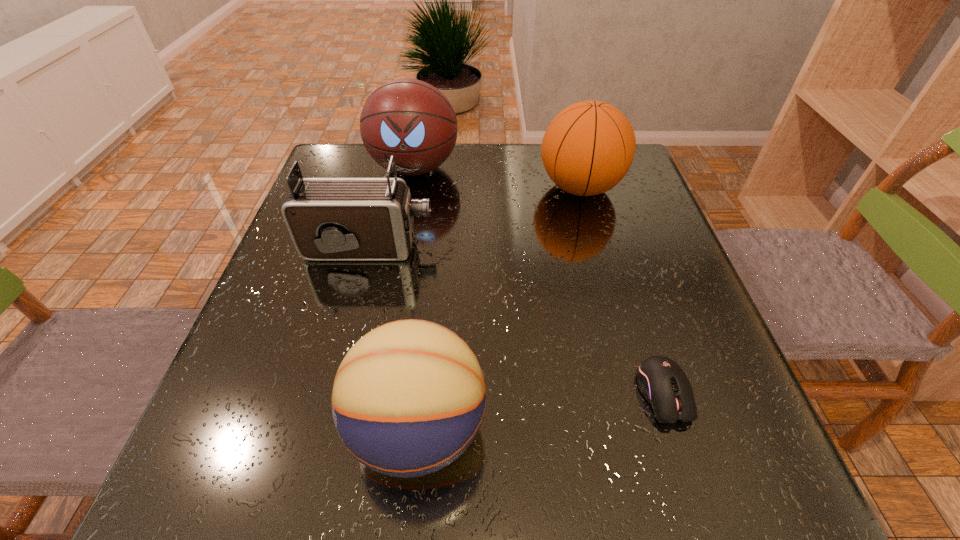
Find the location of a particular element. The image size is (960, 540). the rightmost basketball is located at coordinates (587, 149).

Locate an element on the screen. camcorder is located at coordinates (329, 219).

Locate an element on the screen. the nearest basketball is located at coordinates (409, 397).

Find the location of a particular element. computer mouse is located at coordinates (663, 383).

Locate an element on the screen. The image size is (960, 540). vacant space located on the front of the rightmost basketball is located at coordinates (594, 239).

Where is `free point located 0.050m at the lens of the third nearest object`? The image size is (960, 540). free point located 0.050m at the lens of the third nearest object is located at coordinates point(455,248).

At what (x,y) coordinates should I click in order to perform the action: click on vacant space located on the patterned surface of the nearest basketball. Please return your answer as a coordinate pair (x, y). Looking at the image, I should click on coord(698,429).

Where is `vacant region located on the left of the shortest object`? vacant region located on the left of the shortest object is located at coordinates pos(434,393).

Locate an element on the screen. Image resolution: width=960 pixels, height=540 pixels. object that is at the near edge is located at coordinates [409, 397].

The height and width of the screenshot is (540, 960). I want to click on basketball present at the left edge, so click(408, 118).